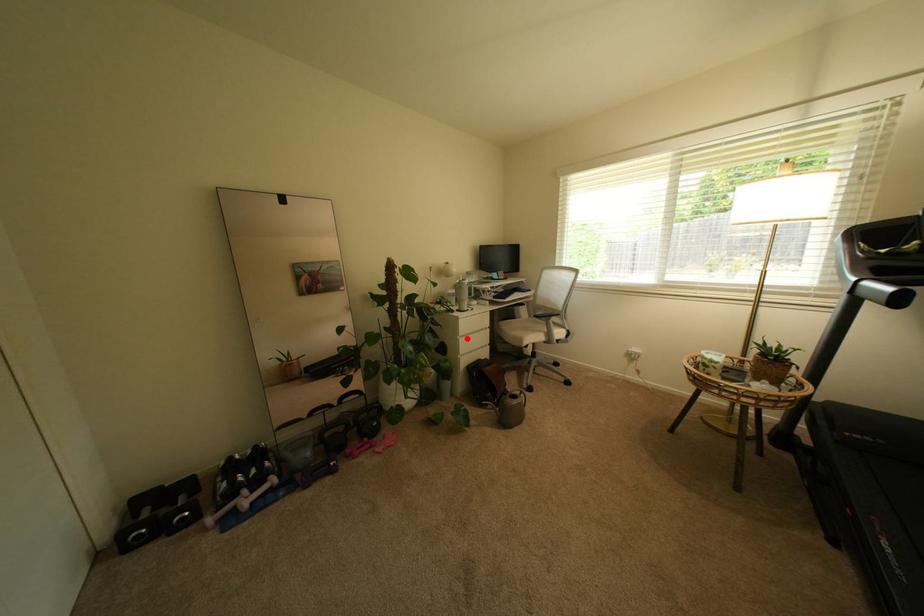
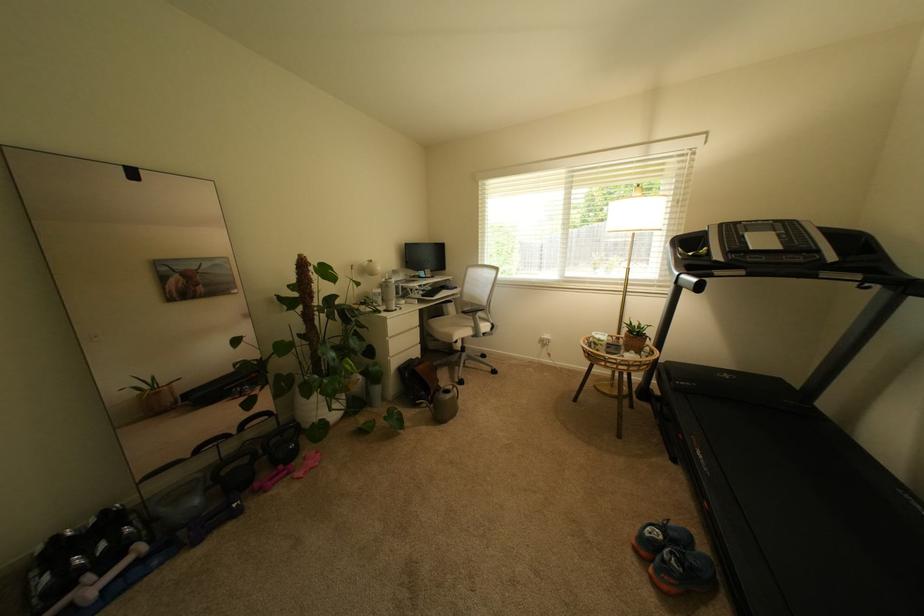
The point at the highlighted location is marked in the first image. Where is the corresponding point in the second image?

(395, 339)